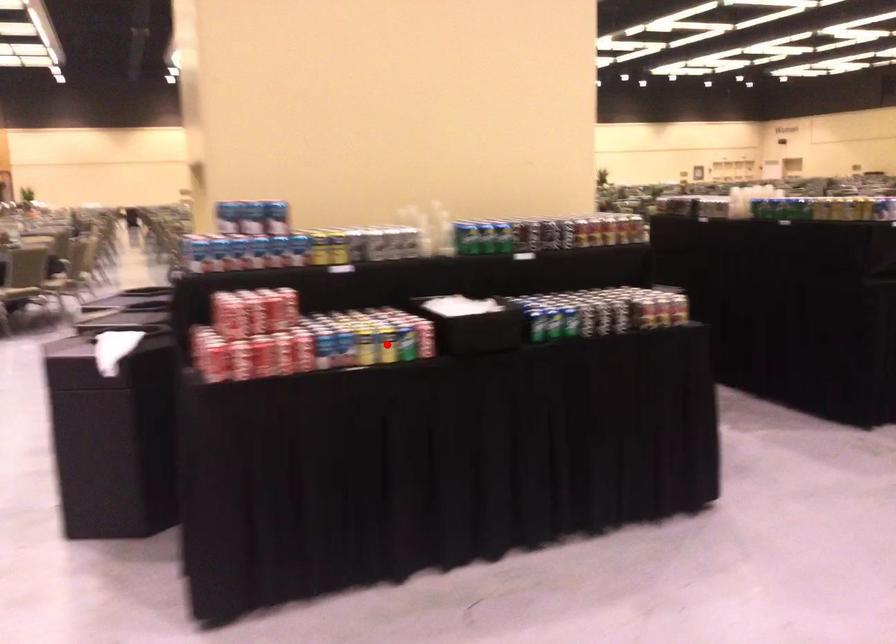
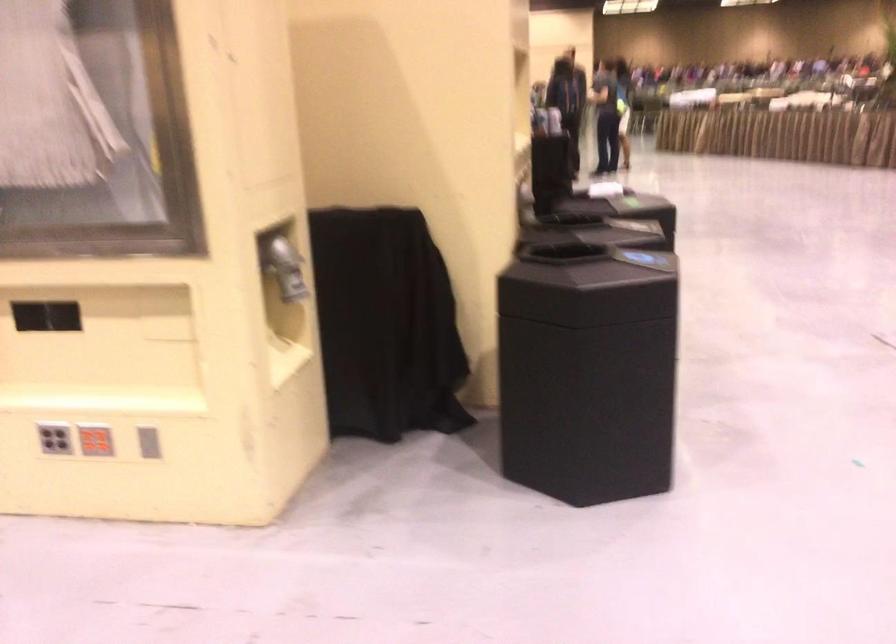
Question: I am providing you with two images of the same scene from different viewpoints. A red point is marked on the first image. At the location where the point appears in image 1, is it still visible in image 2?

Choices:
 (A) Yes
 (B) No

Answer: (B)